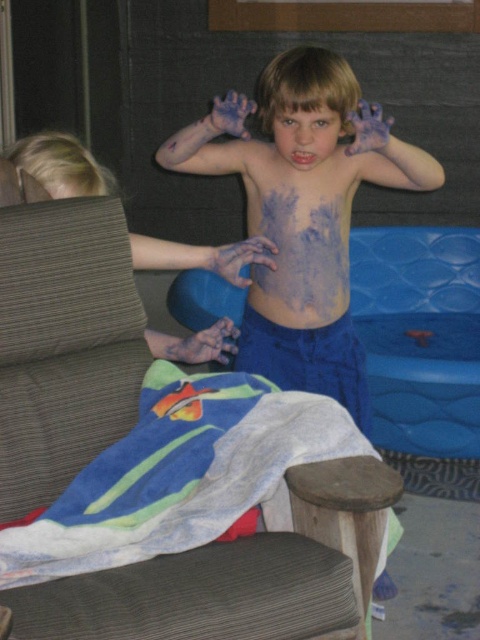
How much distance is there between blue matte skin at center and dark gray fabric armchair at center?

They are 13.35 inches apart.

Does point (382, 122) come behind point (144, 250)?

Yes, point (382, 122) is behind point (144, 250).

I want to click on blue matte skin at center, so click(302, 218).

Is the position of blue matte skin at center more distant than that of blue matte ball at upper center?

Yes, blue matte skin at center is behind blue matte ball at upper center.

Does blue matte skin at center have a lesser width compared to blue matte ball at upper center?

In fact, blue matte skin at center might be wider than blue matte ball at upper center.

You are a GUI agent. You are given a task and a screenshot of the screen. Output one action in this format:
    pyautogui.click(x=<x>, y=<y>)
    Task: Click on the blue matte skin at center
    
    Given the screenshot: What is the action you would take?
    point(302,218)

In the scene shown: Who is more distant from viewer, (343,336) or (231,412)?

Positioned behind is point (343,336).

Does blue matte skin at center have a lesser height compared to multicolored towel at lower left?

No.

Which is behind, point (245, 138) or point (284, 448)?

The point (245, 138) is more distant.

This screenshot has height=640, width=480. In order to click on blue matte skin at center in this screenshot , I will do `click(302, 218)`.